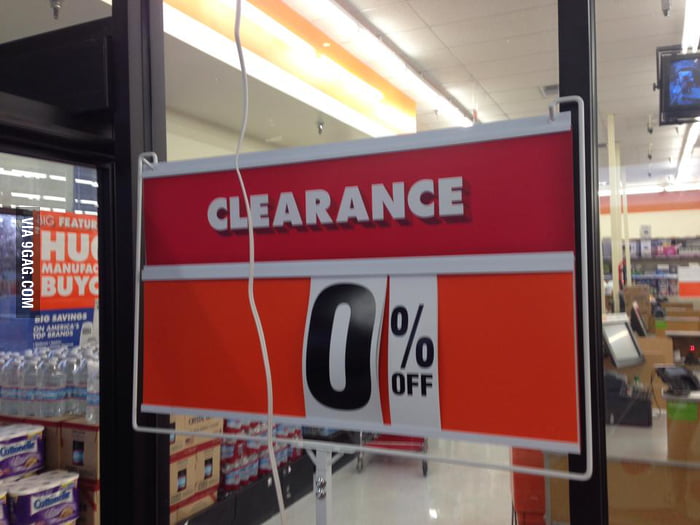
The image size is (700, 525). I want to click on pack of toilet tissue, so click(22, 441), click(1, 502), click(50, 500).